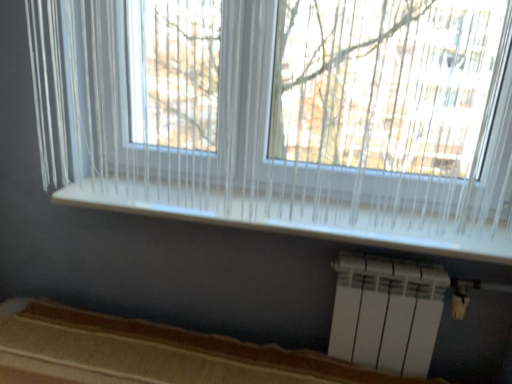
What do you see at coordinates (284, 115) in the screenshot?
I see `white translucent curtain at upper center` at bounding box center [284, 115].

Where is `white wood window sill at center`? The image size is (512, 384). white wood window sill at center is located at coordinates (310, 214).

Based on the photo, is brown fabric bed frame at lower center shorter than white wood window sill at center?

Incorrect, the height of brown fabric bed frame at lower center does not fall short of that of white wood window sill at center.

Is brown fabric bed frame at lower center oriented away from white wood window sill at center?

That's not correct — brown fabric bed frame at lower center is not looking away from white wood window sill at center.

From the image's perspective, does brown fabric bed frame at lower center appear lower than white wood window sill at center?

Indeed, from the image's perspective, brown fabric bed frame at lower center is shown beneath white wood window sill at center.

Is white wood window sill at center located within brown fabric bed frame at lower center?

No, white wood window sill at center is not a part of brown fabric bed frame at lower center.

Would you say brown fabric bed frame at lower center is to the left or to the right of white translucent curtain at upper center in the picture?

brown fabric bed frame at lower center is positioned on white translucent curtain at upper center's left side.

Identify the location of bed frame on the left of white translucent curtain at upper center. (151, 353).

Can you confirm if brown fabric bed frame at lower center is taller than white translucent curtain at upper center?

In fact, brown fabric bed frame at lower center may be shorter than white translucent curtain at upper center.

Considering the sizes of objects brown fabric bed frame at lower center and white translucent curtain at upper center in the image provided, who is thinner, brown fabric bed frame at lower center or white translucent curtain at upper center?

Thinner between the two is white translucent curtain at upper center.

From the image's perspective, relative to brown fabric bed frame at lower center, is white translucent curtain at upper center above or below?

white translucent curtain at upper center is above brown fabric bed frame at lower center.

Which of these two, white translucent curtain at upper center or brown fabric bed frame at lower center, stands taller?

Standing taller between the two is white translucent curtain at upper center.

Considering the positions of objects white translucent curtain at upper center and brown fabric bed frame at lower center in the image provided, who is more to the left, white translucent curtain at upper center or brown fabric bed frame at lower center?

Positioned to the left is brown fabric bed frame at lower center.

Considering the sizes of objects white translucent curtain at upper center and brown fabric bed frame at lower center in the image provided, who is wider, white translucent curtain at upper center or brown fabric bed frame at lower center?

Wider between the two is brown fabric bed frame at lower center.

Is brown fabric bed frame at lower center situated inside white plastic radiator at lower right or outside?

brown fabric bed frame at lower center cannot be found inside white plastic radiator at lower right.

In terms of size, does brown fabric bed frame at lower center appear bigger or smaller than white plastic radiator at lower right?

Clearly, brown fabric bed frame at lower center is larger in size than white plastic radiator at lower right.

Based on the photo, considering the sizes of objects brown fabric bed frame at lower center and white plastic radiator at lower right in the image provided, who is taller, brown fabric bed frame at lower center or white plastic radiator at lower right?

Standing taller between the two is brown fabric bed frame at lower center.

From the image's perspective, would you say brown fabric bed frame at lower center is shown under white plastic radiator at lower right?

Indeed, from the image's perspective, brown fabric bed frame at lower center is shown beneath white plastic radiator at lower right.

From a real-world perspective, which is physically above, white plastic radiator at lower right or brown fabric bed frame at lower center?

white plastic radiator at lower right.

Can you confirm if white plastic radiator at lower right is positioned to the right of brown fabric bed frame at lower center?

Correct, you'll find white plastic radiator at lower right to the right of brown fabric bed frame at lower center.

From the picture: Is white plastic radiator at lower right taller than brown fabric bed frame at lower center?

No.

Can you tell me how much white plastic radiator at lower right and brown fabric bed frame at lower center differ in facing direction?

There is a 0.435-degree angle between the facing directions of white plastic radiator at lower right and brown fabric bed frame at lower center.

Which is correct: white translucent curtain at upper center is inside white wood window sill at center, or outside of it?

white translucent curtain at upper center is not inside white wood window sill at center, it's outside.

Is there a large distance between white translucent curtain at upper center and white wood window sill at center?

white translucent curtain at upper center is actually quite close to white wood window sill at center.

In the scene shown: Is white translucent curtain at upper center positioned with its back to white wood window sill at center?

No, white wood window sill at center is not at the back of white translucent curtain at upper center.

Which of these two, white wood window sill at center or white translucent curtain at upper center, is wider?

Wider between the two is white wood window sill at center.

In the scene shown: Is white wood window sill at center next to white translucent curtain at upper center and touching it?

No, white wood window sill at center is not touching white translucent curtain at upper center.

Is white wood window sill at center facing away from white translucent curtain at upper center?

No, white wood window sill at center is not facing the opposite direction of white translucent curtain at upper center.

Image resolution: width=512 pixels, height=384 pixels. Identify the location of bed frame on the left of white wood window sill at center. (151, 353).

The width and height of the screenshot is (512, 384). Identify the location of bed frame directly beneath the white translucent curtain at upper center (from a real-world perspective). (151, 353).

Based on their spatial positions, is white plastic radiator at lower right or white wood window sill at center closer to white translucent curtain at upper center?

white wood window sill at center lies closer to white translucent curtain at upper center than the other object.

Considering their positions, is white translucent curtain at upper center positioned further to white plastic radiator at lower right than brown fabric bed frame at lower center?

white translucent curtain at upper center is further to white plastic radiator at lower right.

From the picture: Which object lies nearer to the anchor point white wood window sill at center, white plastic radiator at lower right or brown fabric bed frame at lower center?

The object closer to white wood window sill at center is white plastic radiator at lower right.

From the picture: Estimate the real-world distances between objects in this image. Which object is further from white plastic radiator at lower right, white translucent curtain at upper center or white wood window sill at center?

white translucent curtain at upper center.

Based on their spatial positions, is white plastic radiator at lower right or white translucent curtain at upper center closer to brown fabric bed frame at lower center?

white plastic radiator at lower right is positioned closer to the anchor brown fabric bed frame at lower center.

Looking at the image, which one is located further to brown fabric bed frame at lower center, white plastic radiator at lower right or white wood window sill at center?

white wood window sill at center lies further to brown fabric bed frame at lower center than the other object.

When comparing their distances from white translucent curtain at upper center, does white wood window sill at center or brown fabric bed frame at lower center seem closer?

Based on the image, white wood window sill at center appears to be nearer to white translucent curtain at upper center.

Estimate the real-world distances between objects in this image. Which object is further from brown fabric bed frame at lower center, white translucent curtain at upper center or white wood window sill at center?

The object further to brown fabric bed frame at lower center is white translucent curtain at upper center.

At what (x,y) coordinates should I click in order to perform the action: click on air conditioning between white translucent curtain at upper center and brown fabric bed frame at lower center from top to bottom. Please return your answer as a coordinate pair (x, y). The image size is (512, 384). Looking at the image, I should click on (387, 313).

I want to click on window sill between white translucent curtain at upper center and white plastic radiator at lower right in the up-down direction, so click(x=310, y=214).

Locate an element on the screen. window sill between white translucent curtain at upper center and brown fabric bed frame at lower center in the vertical direction is located at coordinates (x=310, y=214).

You are a GUI agent. You are given a task and a screenshot of the screen. Output one action in this format:
    pyautogui.click(x=<x>, y=<y>)
    Task: Click on the window sill between brown fabric bed frame at lower center and white plastic radiator at lower right in the horizontal direction
    The width and height of the screenshot is (512, 384).
    Given the screenshot: What is the action you would take?
    pyautogui.click(x=310, y=214)